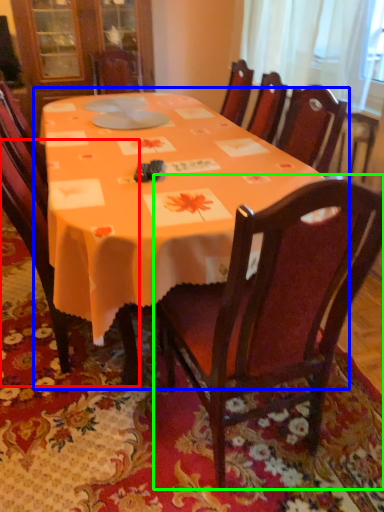
Question: Estimate the real-world distances between objects in this image. Which object is closer to chair (highlighted by a red box), table (highlighted by a blue box) or chair (highlighted by a green box)?

Choices:
 (A) table
 (B) chair

Answer: (A)